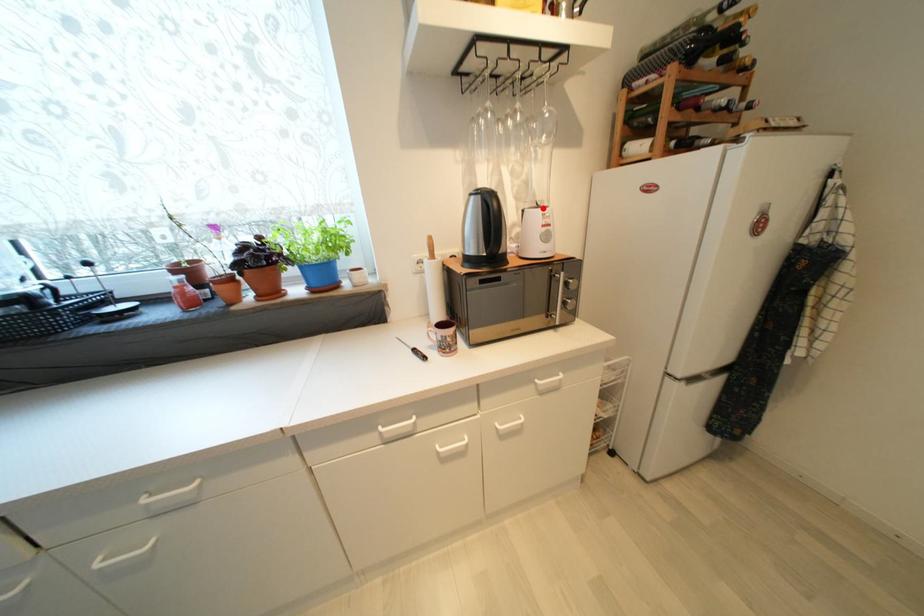
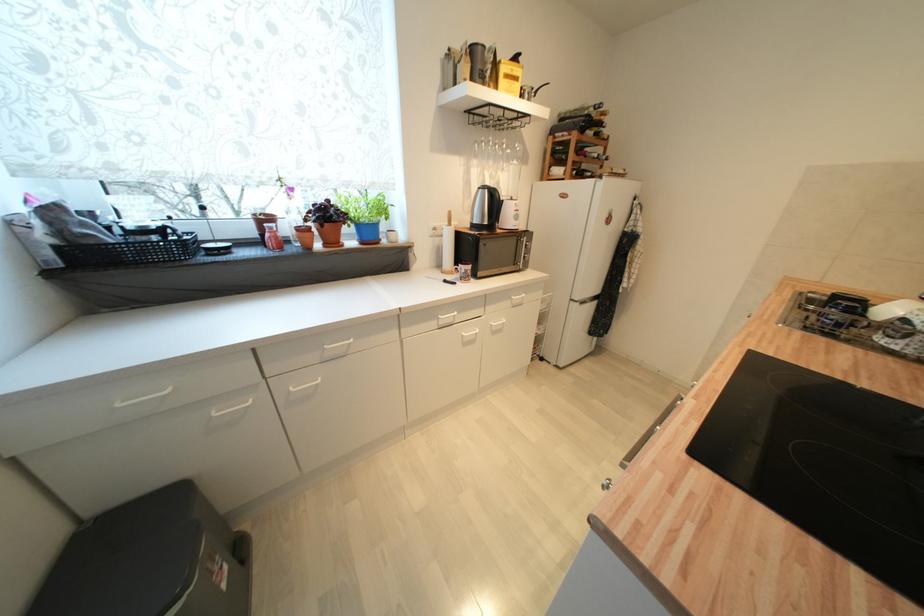
The point at the highlighted location is marked in the first image. Where is the corresponding point in the second image?

(517, 201)